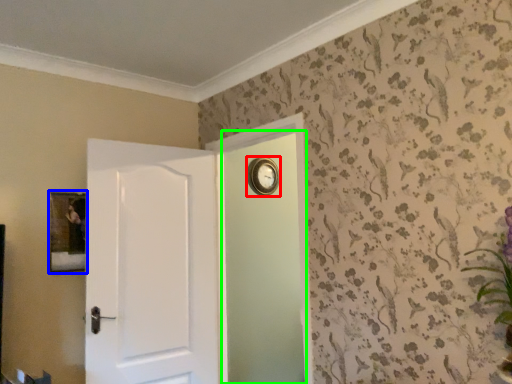
Question: Based on their relative distances, which object is farther from clock (highlighted by a red box)? Choose from picture frame (highlighted by a blue box) and screen door (highlighted by a green box).

Choices:
 (A) picture frame
 (B) screen door

Answer: (A)